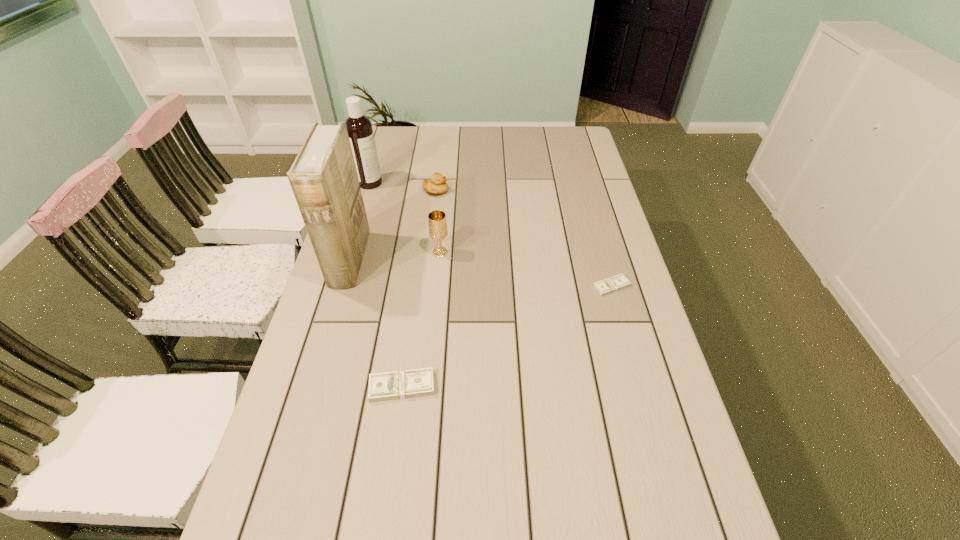
Where is `the nearest object`? The width and height of the screenshot is (960, 540). the nearest object is located at coordinates (403, 384).

The height and width of the screenshot is (540, 960). In order to click on the left money in this screenshot , I will do `click(403, 384)`.

Identify the location of the farther money. (618, 282).

Find the location of a particular element. This screenshot has width=960, height=540. the shorter money is located at coordinates (618, 282).

You are a GUI agent. You are given a task and a screenshot of the screen. Output one action in this format:
    pyautogui.click(x=<x>, y=<y>)
    Task: Click on the duckling
    
    Given the screenshot: What is the action you would take?
    pyautogui.click(x=437, y=185)

You are a GUI agent. You are given a task and a screenshot of the screen. Output one action in this format:
    pyautogui.click(x=<x>, y=<y>)
    Task: Click on the second tallest object
    Image resolution: width=960 pixels, height=540 pixels.
    Given the screenshot: What is the action you would take?
    pyautogui.click(x=360, y=131)

This screenshot has height=540, width=960. What are the coordinates of `the third tallest object` in the screenshot? It's located at (437, 223).

The height and width of the screenshot is (540, 960). I want to click on phonebook, so click(323, 177).

The width and height of the screenshot is (960, 540). I want to click on vacant space located 0.230m on the back of the nearer money, so click(414, 300).

You are a GUI agent. You are given a task and a screenshot of the screen. Output one action in this format:
    pyautogui.click(x=<x>, y=<y>)
    Task: Click on the vacant space located 0.120m on the back of the right money
    This screenshot has width=960, height=540.
    Given the screenshot: What is the action you would take?
    pyautogui.click(x=601, y=249)